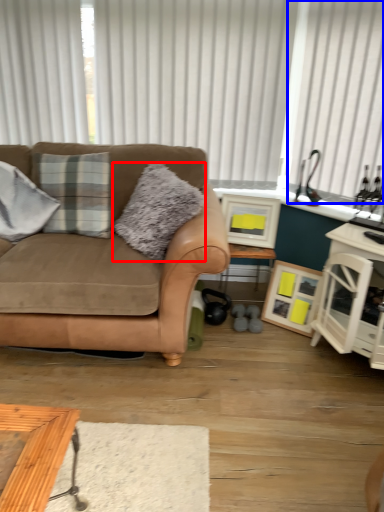
Question: Which of the following is the closest to the observer, pillow (highlighted by a red box) or curtain (highlighted by a blue box)?

Choices:
 (A) pillow
 (B) curtain

Answer: (A)